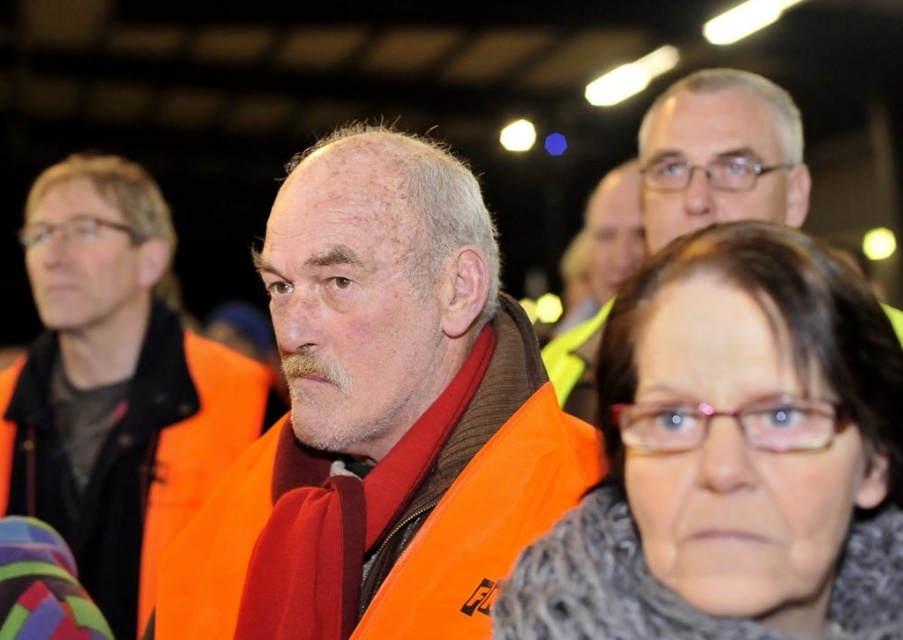
Can you confirm if orange fabric vest at left is thinner than matte orange vest at upper right?

No.

Can you confirm if orange fabric vest at left is taller than matte orange vest at upper right?

Correct, orange fabric vest at left is much taller as matte orange vest at upper right.

Who is more distant from viewer, [154,464] or [559,340]?

Positioned behind is point [154,464].

You are a GUI agent. You are given a task and a screenshot of the screen. Output one action in this format:
    pyautogui.click(x=<x>, y=<y>)
    Task: Click on the orange fabric vest at left
    
    Given the screenshot: What is the action you would take?
    pyautogui.click(x=115, y=384)

Which is in front, point (168, 621) or point (34, 400)?

Point (168, 621)

Can you confirm if orange fabric vest at center is bigger than orange fabric vest at left?

Actually, orange fabric vest at center might be smaller than orange fabric vest at left.

Image resolution: width=903 pixels, height=640 pixels. I want to click on orange fabric vest at center, so pyautogui.click(x=386, y=403).

The height and width of the screenshot is (640, 903). What are the coordinates of `orange fabric vest at center` in the screenshot? It's located at (386, 403).

Can you confirm if orange fabric vest at center is bigger than matte orange vest at center?

Correct, orange fabric vest at center is larger in size than matte orange vest at center.

Who is shorter, orange fabric vest at center or matte orange vest at center?

matte orange vest at center is shorter.

At what (x,y) coordinates should I click in order to perform the action: click on orange fabric vest at center. Please return your answer as a coordinate pair (x, y). This screenshot has width=903, height=640. Looking at the image, I should click on (386, 403).

Identify the location of orange fabric vest at center. (386, 403).